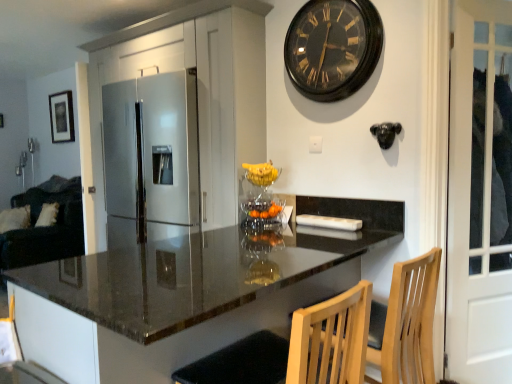
Question: Considering the positions of point (488, 119) and point (208, 112), is point (488, 119) closer or farther from the camera than point (208, 112)?

Choices:
 (A) farther
 (B) closer

Answer: (B)

Question: From the image's perspective, relative to satin silver refrigerator at center, is white glass door at right above or below?

Choices:
 (A) above
 (B) below

Answer: (B)

Question: Which is nearer to the polished granite countertop at center?

Choices:
 (A) velvet dark green couch at left
 (B) wooden swivel chair at lower right
 (C) black matte picture frame at upper left
 (D) white glass door at right
 (E) satin silver refrigerator at center

Answer: (B)

Question: Which is farther from the polished granite countertop at center?

Choices:
 (A) velvet dark green couch at left
 (B) wooden swivel chair at lower right
 (C) white glass door at right
 (D) satin silver refrigerator at center
 (E) black matte picture frame at upper left

Answer: (E)